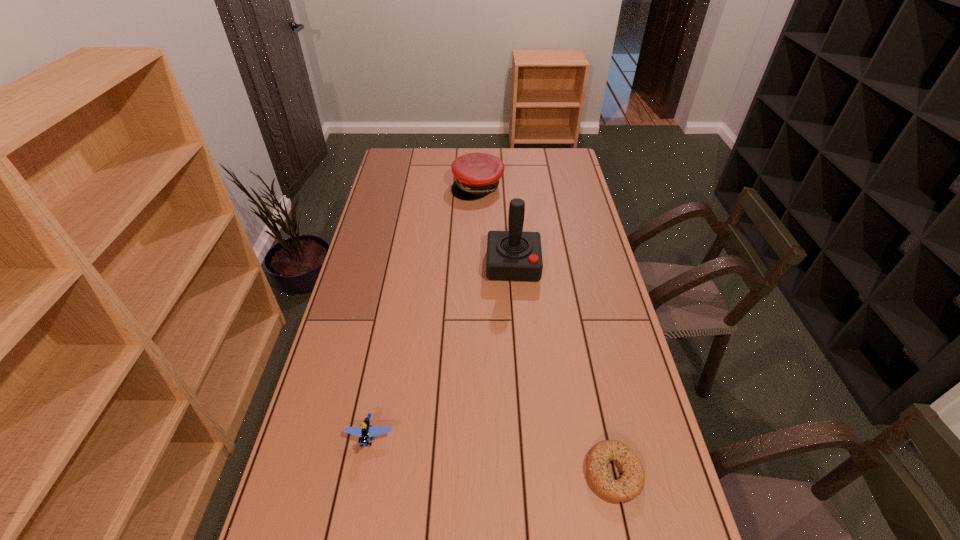
I want to click on free point that satisfies the following two spatial constraints: 1. on the front-facing side of the rightmost object; 2. on the left side of the second shortest object, so click(363, 473).

You are a GUI agent. You are given a task and a screenshot of the screen. Output one action in this format:
    pyautogui.click(x=<x>, y=<y>)
    Task: Click on the free space that satisfies the following two spatial constraints: 1. on the front-facing side of the third tallest object; 2. on the right side of the rightmost object
    
    Given the screenshot: What is the action you would take?
    pyautogui.click(x=363, y=473)

Find the location of a particular element. This screenshot has height=540, width=960. vacant space that satisfies the following two spatial constraints: 1. on the front side of the bagel; 2. on the right side of the farthest object is located at coordinates (476, 473).

At what (x,y) coordinates should I click in order to perform the action: click on free location that satisfies the following two spatial constraints: 1. on the front side of the shortest object; 2. on the left side of the tallest object. Please return your answer as a coordinate pair (x, y). The height and width of the screenshot is (540, 960). Looking at the image, I should click on (530, 473).

The width and height of the screenshot is (960, 540). Find the location of `blank area in the image that satisfies the following two spatial constraints: 1. on the front side of the shortest object; 2. on the right side of the cap`. blank area in the image that satisfies the following two spatial constraints: 1. on the front side of the shortest object; 2. on the right side of the cap is located at coordinates (476, 473).

Identify the location of free region that satisfies the following two spatial constraints: 1. on the front side of the cap; 2. on the left side of the joystick. This screenshot has height=540, width=960. (477, 265).